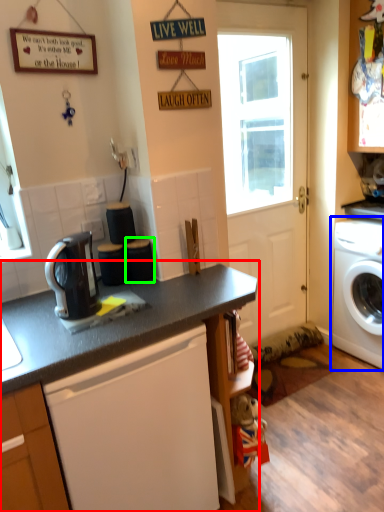
Question: Which object is positioned closest to countertop (highlighted by a red box)? Select from washing machine (highlighted by a blue box) and appliance (highlighted by a green box).

Choices:
 (A) washing machine
 (B) appliance

Answer: (B)